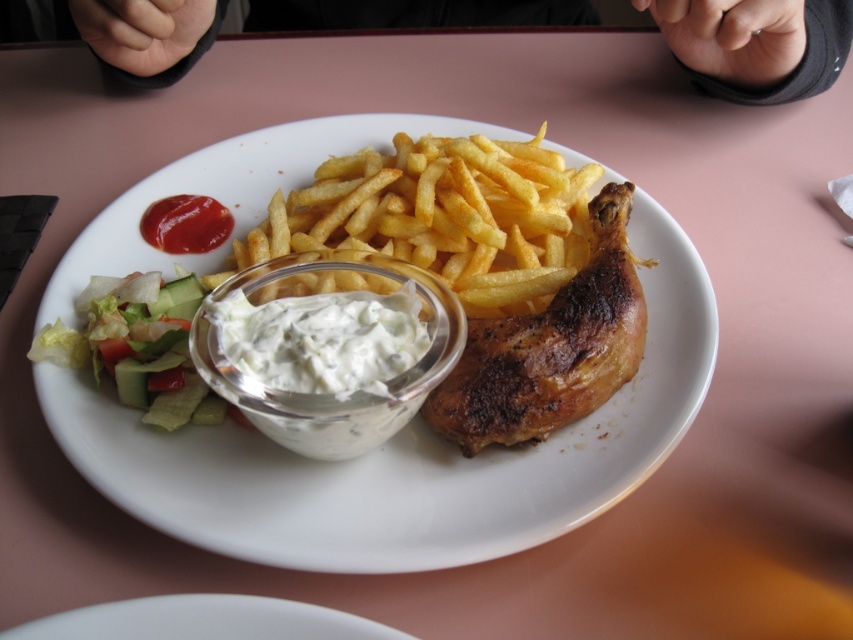
You are a food delivery person who needs to place a hot meal on the table without touching the edges. The table has a pink surface. The meal is on a white matte plate at center and there is a brown crispy chicken leg at center. Which object should you avoid placing your hand near to prevent touching the table?

You should avoid placing your hand near the brown crispy chicken leg at center because the white matte plate at center is to its left, meaning the chicken leg is closer to the edge of the table.

You are a food delivery person who needs to slide a divider between the golden crispy french fries at center and the brown crispy chicken leg at center to prevent them from touching. The divider is 3 inches wide. Can you fit it between them?

The distance between the golden crispy french fries at center and the brown crispy chicken leg at center is 3.86 inches. Since the divider is 3 inches wide, it can fit between them as the space is wider than the divider.

You are a food critic evaluating the layout of this meal. The plate has limited space. Which component, the golden crispy french fries at center or the fresh green salad at left, takes up more horizontal space on the plate?

The golden crispy french fries at center takes up more horizontal space than the fresh green salad at left as its width surpasses the salad.